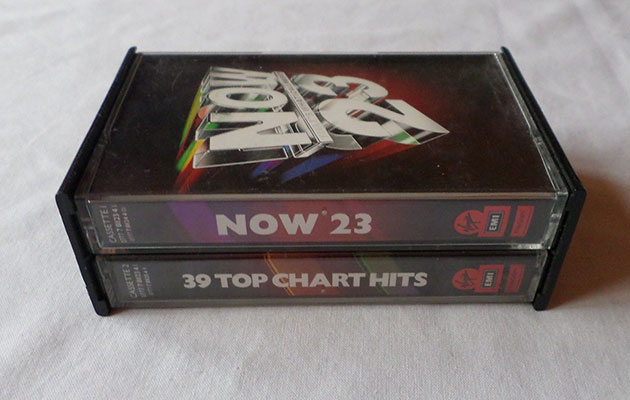
Where is `white cloth background`? This screenshot has height=400, width=630. white cloth background is located at coordinates (544, 55).